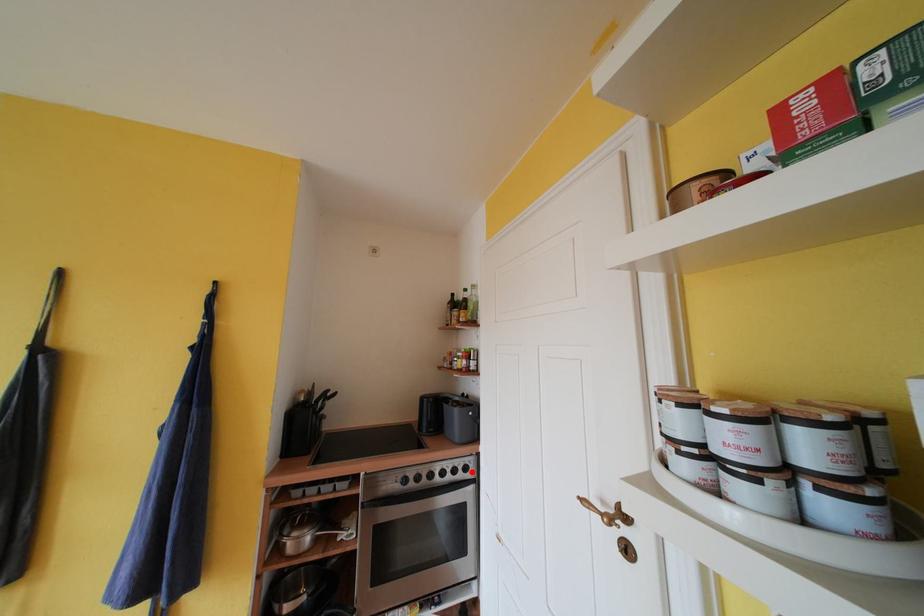
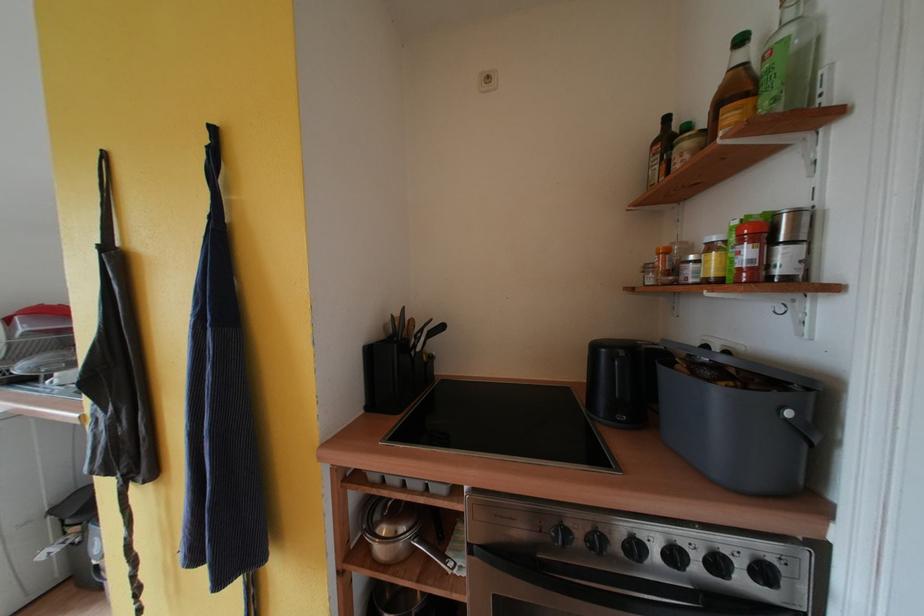
The point at the highlighted location is marked in the first image. Where is the corresponding point in the second image?

(771, 577)